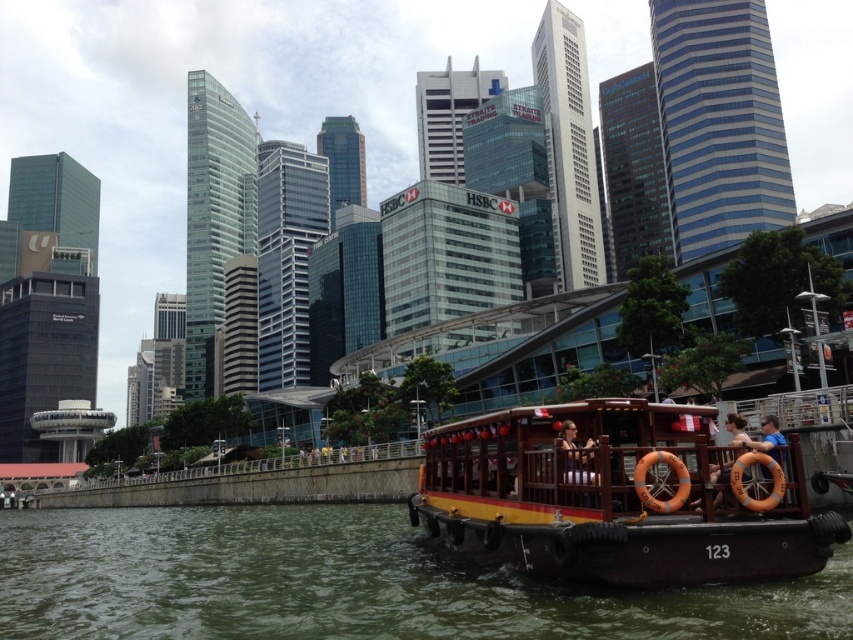
Question: Can you confirm if greenish water at lower left is thinner than wooden boat at lower right?

Choices:
 (A) yes
 (B) no

Answer: (B)

Question: Can you confirm if greenish water at lower left is positioned to the left of wooden boat at lower right?

Choices:
 (A) yes
 (B) no

Answer: (A)

Question: Which point is farther to the camera?

Choices:
 (A) wooden boat at lower right
 (B) greenish water at lower left

Answer: (A)

Question: Can you confirm if greenish water at lower left is thinner than wooden boat at lower right?

Choices:
 (A) yes
 (B) no

Answer: (B)